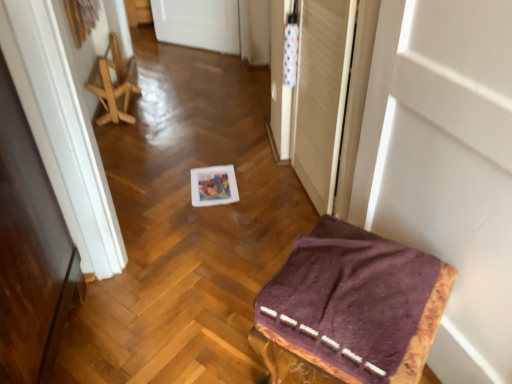
Question: From a real-world perspective, is wooden folding chair at left, the first furniture in the top-to-bottom sequence, positioned under purple fabric-covered stool at lower right, arranged as the first furniture when viewed from the right, based on gravity?

Choices:
 (A) no
 (B) yes

Answer: (B)

Question: Is wooden folding chair at left, the first furniture in the top-to-bottom sequence, taller than purple fabric-covered stool at lower right, the first furniture positioned from the front?

Choices:
 (A) yes
 (B) no

Answer: (B)

Question: Can you confirm if wooden folding chair at left, the first furniture in the top-to-bottom sequence, is thinner than purple fabric-covered stool at lower right, the first furniture positioned from the front?

Choices:
 (A) yes
 (B) no

Answer: (A)

Question: Considering the relative sizes of wooden folding chair at left, marked as the 2th furniture in a right-to-left arrangement, and purple fabric-covered stool at lower right, acting as the 2th furniture starting from the back, in the image provided, is wooden folding chair at left, marked as the 2th furniture in a right-to-left arrangement, bigger than purple fabric-covered stool at lower right, acting as the 2th furniture starting from the back,?

Choices:
 (A) no
 (B) yes

Answer: (A)

Question: Is wooden folding chair at left, the first furniture in the top-to-bottom sequence, wider than purple fabric-covered stool at lower right, arranged as the first furniture when viewed from the right?

Choices:
 (A) yes
 (B) no

Answer: (B)

Question: From a real-world perspective, is transparent plastic screen door at upper right physically located above or below white matte door at upper right?

Choices:
 (A) above
 (B) below

Answer: (B)

Question: Based on their positions, is transparent plastic screen door at upper right located to the left or right of white matte door at upper right?

Choices:
 (A) left
 (B) right

Answer: (A)

Question: Considering the positions of point (298, 168) and point (437, 213), is point (298, 168) closer or farther from the camera than point (437, 213)?

Choices:
 (A) closer
 (B) farther

Answer: (B)

Question: From their relative heights in the image, would you say transparent plastic screen door at upper right is taller or shorter than white matte door at upper right?

Choices:
 (A) tall
 (B) short

Answer: (B)

Question: From a real-world perspective, is purple fabric-covered stool at lower right, acting as the 2th furniture starting from the back, physically located above or below transparent plastic screen door at upper right?

Choices:
 (A) below
 (B) above

Answer: (A)

Question: Considering the positions of purple fabric-covered stool at lower right, arranged as the first furniture when viewed from the right, and transparent plastic screen door at upper right in the image, is purple fabric-covered stool at lower right, arranged as the first furniture when viewed from the right, wider or thinner than transparent plastic screen door at upper right?

Choices:
 (A) thin
 (B) wide

Answer: (B)

Question: From their relative heights in the image, would you say purple fabric-covered stool at lower right, which appears as the 1th furniture when ordered from the bottom, is taller or shorter than transparent plastic screen door at upper right?

Choices:
 (A) tall
 (B) short

Answer: (B)

Question: From the image's perspective, is purple fabric-covered stool at lower right, which appears as the 1th furniture when ordered from the bottom, above or below transparent plastic screen door at upper right?

Choices:
 (A) below
 (B) above

Answer: (A)

Question: Considering the positions of transparent plastic screen door at upper right and purple fabric-covered stool at lower right, which appears as the 1th furniture when ordered from the bottom, in the image, is transparent plastic screen door at upper right bigger or smaller than purple fabric-covered stool at lower right, which appears as the 1th furniture when ordered from the bottom,?

Choices:
 (A) small
 (B) big

Answer: (A)

Question: Based on their positions, is transparent plastic screen door at upper right located to the left or right of purple fabric-covered stool at lower right, acting as the 2th furniture starting from the back?

Choices:
 (A) right
 (B) left

Answer: (B)